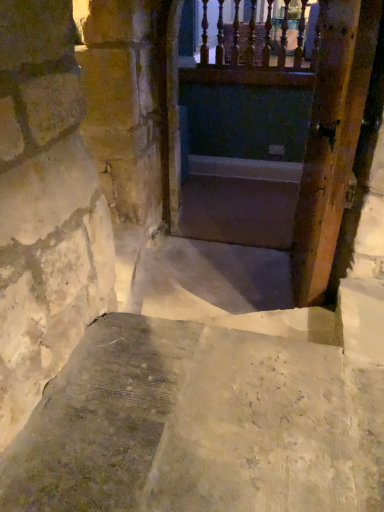
Question: From a real-world perspective, is smooth concrete stairs at center below wooden door at right?

Choices:
 (A) yes
 (B) no

Answer: (A)

Question: Could you tell me if smooth concrete stairs at center is facing wooden door at right?

Choices:
 (A) no
 (B) yes

Answer: (A)

Question: Is smooth concrete stairs at center closer to camera compared to wooden door at right?

Choices:
 (A) no
 (B) yes

Answer: (A)

Question: Would you say wooden door at right is part of smooth concrete stairs at center's contents?

Choices:
 (A) yes
 (B) no

Answer: (B)

Question: Does smooth concrete stairs at center come behind wooden door at right?

Choices:
 (A) yes
 (B) no

Answer: (A)

Question: Considering the positions of point (216, 176) and point (357, 29), is point (216, 176) closer or farther from the camera than point (357, 29)?

Choices:
 (A) closer
 (B) farther

Answer: (B)

Question: Is smooth concrete stairs at center in front of or behind wooden door at right in the image?

Choices:
 (A) behind
 (B) front

Answer: (A)

Question: From the image's perspective, is smooth concrete stairs at center positioned above or below wooden door at right?

Choices:
 (A) above
 (B) below

Answer: (A)

Question: Is smooth concrete stairs at center taller or shorter than wooden door at right?

Choices:
 (A) tall
 (B) short

Answer: (B)

Question: From their relative heights in the image, would you say wooden railing at upper center is taller or shorter than wooden door at right?

Choices:
 (A) short
 (B) tall

Answer: (A)

Question: Is wooden railing at upper center wider or thinner than wooden door at right?

Choices:
 (A) wide
 (B) thin

Answer: (A)

Question: Would you say wooden railing at upper center is to the left or to the right of wooden door at right in the picture?

Choices:
 (A) right
 (B) left

Answer: (B)

Question: From the image's perspective, is wooden railing at upper center positioned above or below wooden door at right?

Choices:
 (A) above
 (B) below

Answer: (A)

Question: From the image's perspective, relative to wooden railing at upper center, is wooden door at right above or below?

Choices:
 (A) below
 (B) above

Answer: (A)

Question: Is point (367, 62) closer or farther from the camera than point (218, 226)?

Choices:
 (A) farther
 (B) closer

Answer: (B)